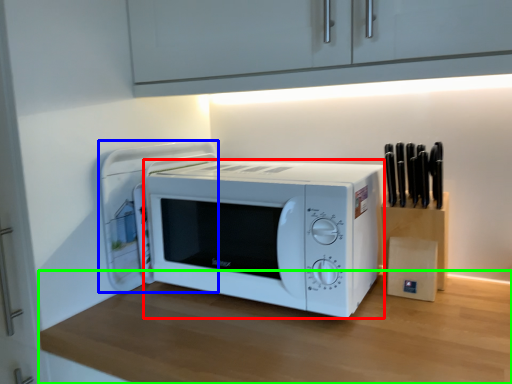
Question: Which object is the closest to the microwave oven (highlighted by a red box)? Choose among these: appliance (highlighted by a blue box) or table (highlighted by a green box).

Choices:
 (A) appliance
 (B) table

Answer: (B)